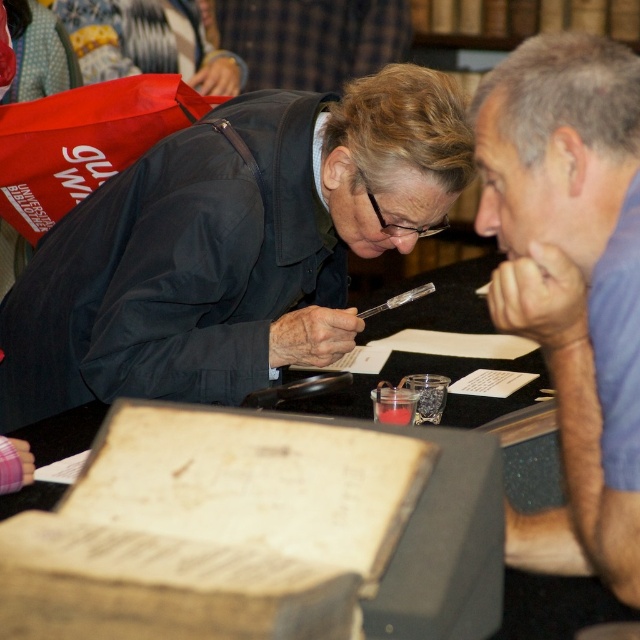
Question: Is dark gray jacket at upper left above blue cotton shirt at upper right?

Choices:
 (A) yes
 (B) no

Answer: (A)

Question: Is dark gray jacket at upper left thinner than blue cotton shirt at upper right?

Choices:
 (A) yes
 (B) no

Answer: (B)

Question: Observing the image, what is the correct spatial positioning of dark gray jacket at upper left in reference to blue cotton shirt at upper right?

Choices:
 (A) below
 (B) above

Answer: (B)